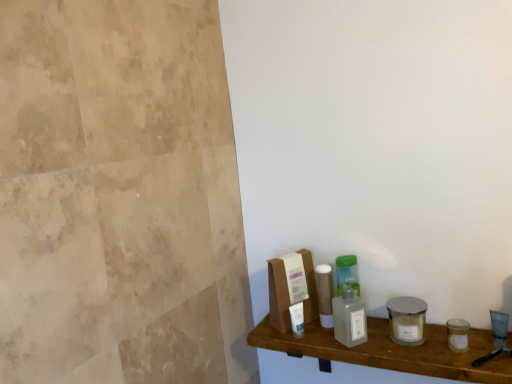
Question: Is transparent plastic bottle at center situated inside translucent plastic bottles at center or outside?

Choices:
 (A) inside
 (B) outside

Answer: (B)

Question: From the image's perspective, is transparent plastic bottle at center located above or below translucent plastic bottles at center?

Choices:
 (A) above
 (B) below

Answer: (A)

Question: Is point (335, 297) closer or farther from the camera than point (494, 372)?

Choices:
 (A) farther
 (B) closer

Answer: (A)

Question: Visually, is translucent plastic bottles at center positioned to the left or to the right of transparent plastic bottle at center?

Choices:
 (A) right
 (B) left

Answer: (A)

Question: Looking at the image, does translucent plastic bottles at center seem bigger or smaller compared to transparent plastic bottle at center?

Choices:
 (A) small
 (B) big

Answer: (B)

Question: Considering the positions of translucent plastic bottles at center and transparent plastic bottle at center in the image, is translucent plastic bottles at center wider or thinner than transparent plastic bottle at center?

Choices:
 (A) thin
 (B) wide

Answer: (B)

Question: From a real-world perspective, relative to transparent plastic bottle at center, is translucent plastic bottles at center vertically above or below?

Choices:
 (A) above
 (B) below

Answer: (B)